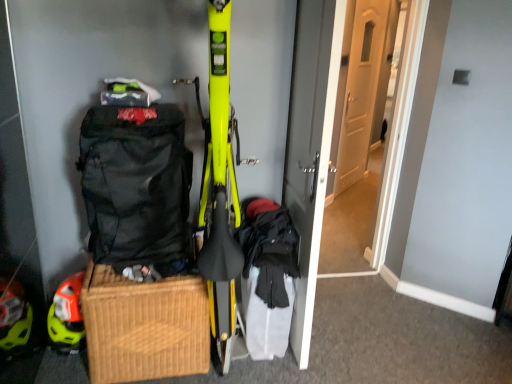
Question: Is orange matte helmet at lower left inside or outside of white wooden door at center, which appears as the first door when viewed from the right?

Choices:
 (A) inside
 (B) outside

Answer: (B)

Question: From their relative heights in the image, would you say orange matte helmet at lower left is taller or shorter than white wooden door at center, which appears as the second door when viewed from the left?

Choices:
 (A) tall
 (B) short

Answer: (B)

Question: Estimate the real-world distances between objects in this image. Which object is closer to the white wooden door at center, which appears as the second door when viewed from the left?

Choices:
 (A) woven brown picnic basket at lower left
 (B) matte gray door at center, which is counted as the 1th door, starting from the left
 (C) orange matte helmet at lower left
 (D) black fabric backpack at left

Answer: (B)

Question: Which is nearer to the matte gray door at center, which ranks as the 2th door in right-to-left order?

Choices:
 (A) white wooden door at center, which appears as the first door when viewed from the right
 (B) woven brown picnic basket at lower left
 (C) black fabric backpack at left
 (D) orange matte helmet at lower left

Answer: (C)